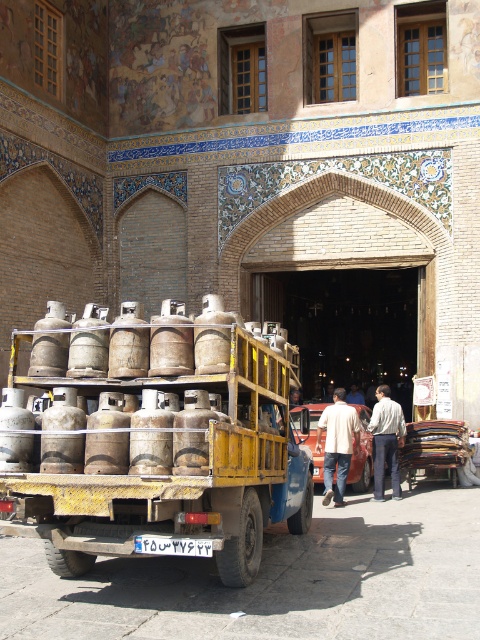
You are a pedestrian standing in front of the traditional building. You see the rusty metal truck at center and the light beige fabric shirt at center. Which object is positioned higher from the ground?

The rusty metal truck at center is above the light beige fabric shirt at center, so the rusty metal truck at center is positioned higher from the ground.

You are standing in front of the traditional building and see both the light beige fabric shirt at center and the light beige sweater at center. Which one is nearer to you?

The light beige fabric shirt at center is closer to the viewer than the light beige sweater at center, so the light beige fabric shirt at center is nearer to you.

You are a delivery person who needs to park your rusty metal truck at center in a parking spot that can only accommodate vehicles narrower than the light beige sweater at center. Based on the scene, can your truck fit in the parking spot?

The rusty metal truck at center is wider than the light beige sweater at center, so it cannot fit into the parking spot designed for narrower vehicles.